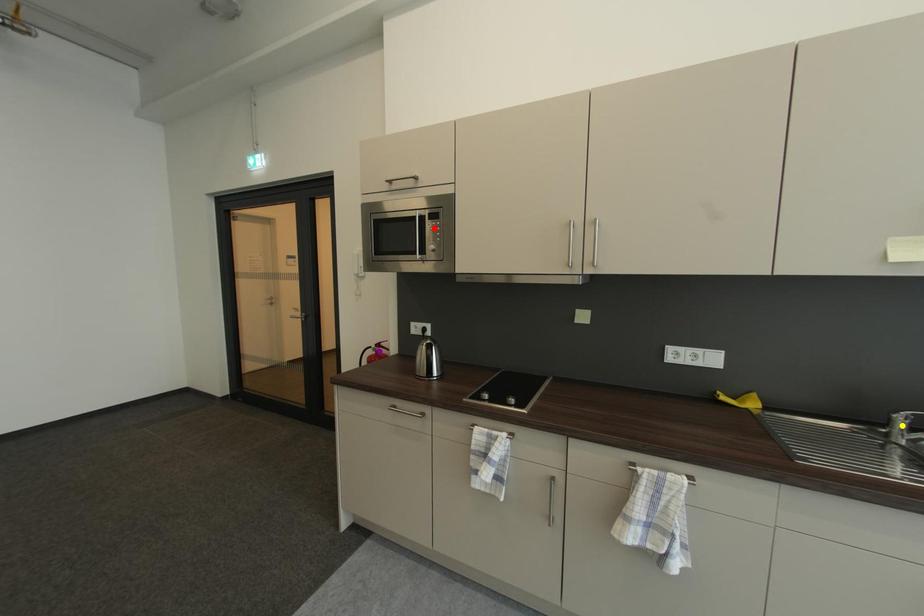
Order these from farthest to nearest:
- yellow point
- purple point
- red point

purple point, red point, yellow point